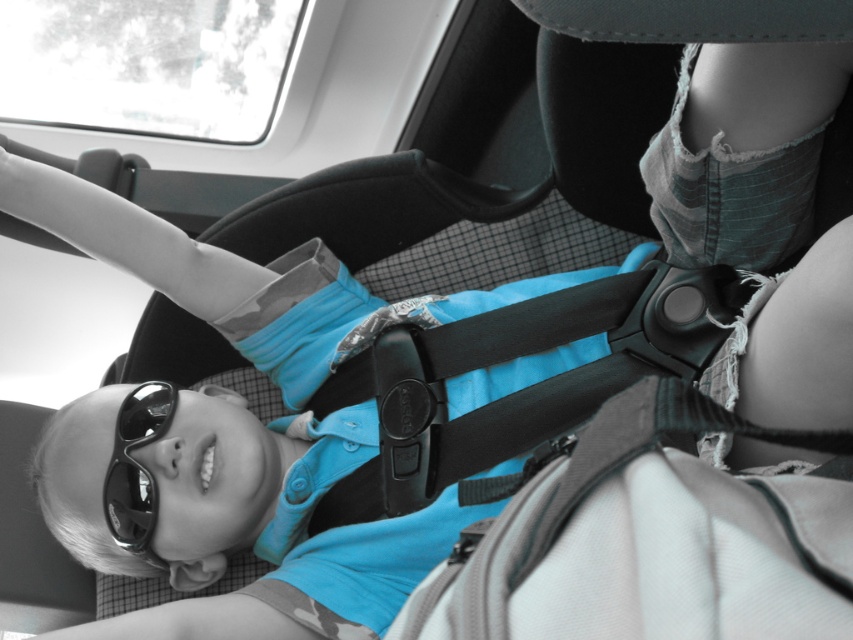
Question: Can you confirm if black fabric seatbelt at center is thinner than black reflective sunglasses at lower left?

Choices:
 (A) no
 (B) yes

Answer: (A)

Question: Is black fabric seatbelt at center bigger than black reflective sunglasses at lower left?

Choices:
 (A) no
 (B) yes

Answer: (B)

Question: Which point appears closest to the camera in this image?

Choices:
 (A) (155, 385)
 (B) (485, 444)

Answer: (B)

Question: Does black fabric seatbelt at center come in front of black reflective sunglasses at lower left?

Choices:
 (A) no
 (B) yes

Answer: (B)